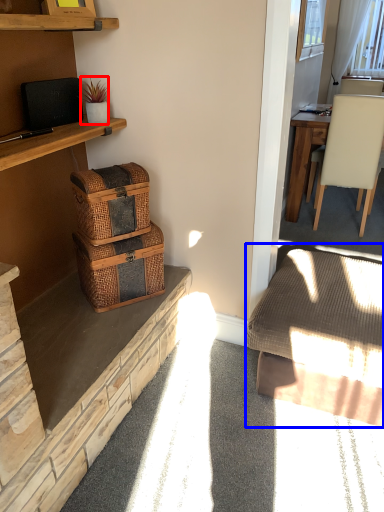
Question: Which point is further to the camera, houseplant (highlighted by a red box) or studio couch (highlighted by a blue box)?

Choices:
 (A) houseplant
 (B) studio couch

Answer: (A)